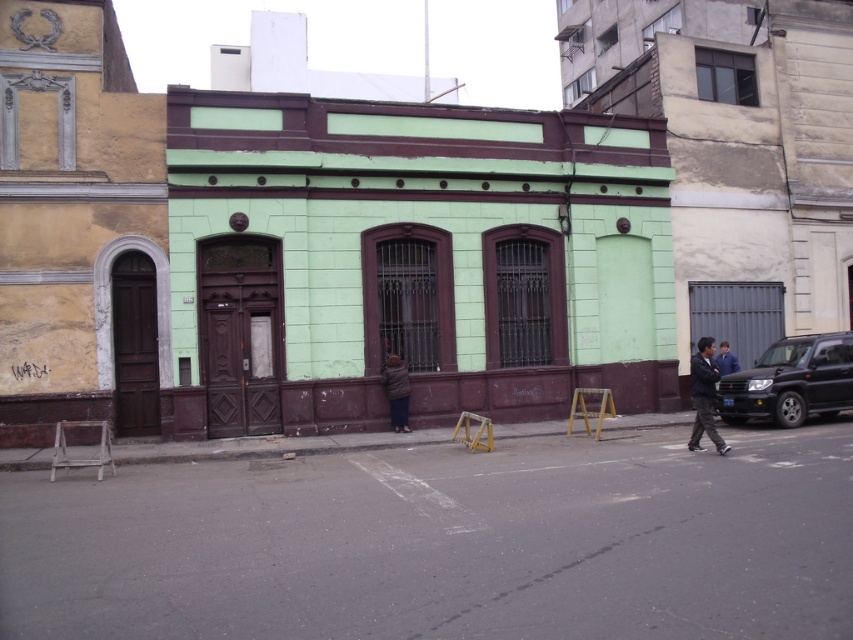
Question: Which point is farther from the camera taking this photo?

Choices:
 (A) (770, 349)
 (B) (398, 374)
 (C) (701, 378)
 (D) (717, 364)

Answer: (D)

Question: Which of these objects is positioned closest to the black matte suv at right?

Choices:
 (A) brown fuzzy coat at center
 (B) blue denim jacket at lower right

Answer: (B)

Question: Is black matte suv at right closer to the viewer compared to blue denim jacket at lower right?

Choices:
 (A) no
 (B) yes

Answer: (B)

Question: Is dark blue jacket at lower right wider than brown fuzzy coat at center?

Choices:
 (A) no
 (B) yes

Answer: (A)

Question: Which object is farther from the camera taking this photo?

Choices:
 (A) black matte suv at right
 (B) blue denim jacket at lower right

Answer: (B)

Question: Does black matte suv at right have a lesser width compared to blue denim jacket at lower right?

Choices:
 (A) no
 (B) yes

Answer: (A)